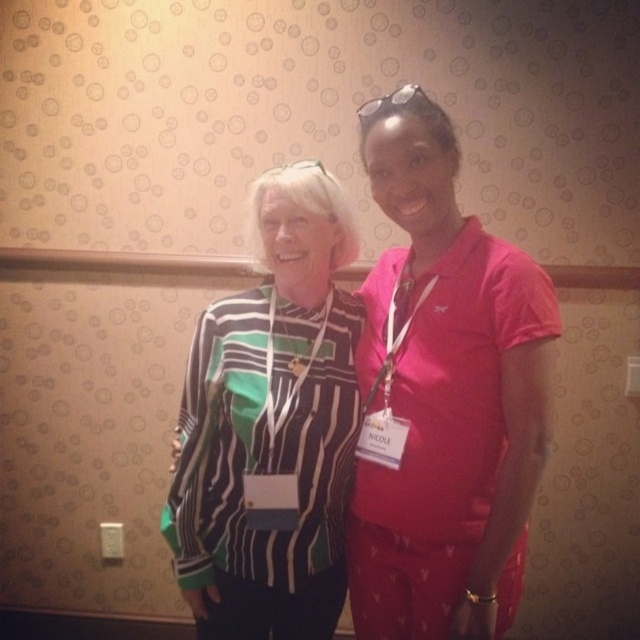
Is pink matte shirt at center in front of striped knit sweater at center?

Yes, it is.

Is pink matte shirt at center to the left of striped knit sweater at center from the viewer's perspective?

Incorrect, pink matte shirt at center is not on the left side of striped knit sweater at center.

Locate an element on the screen. The width and height of the screenshot is (640, 640). pink matte shirt at center is located at coordinates (444, 396).

Identify the location of pink matte shirt at center. The image size is (640, 640). (444, 396).